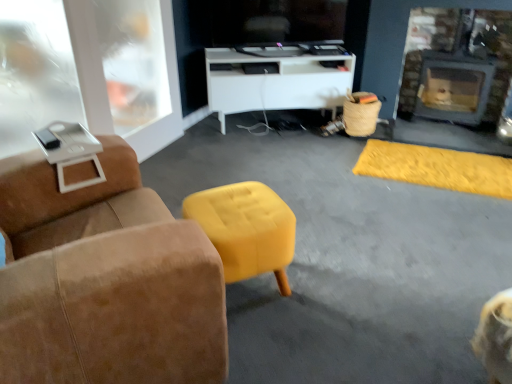
The height and width of the screenshot is (384, 512). What are the coordinates of `space that is in front of yellow fabric stool at center` in the screenshot? It's located at (274, 347).